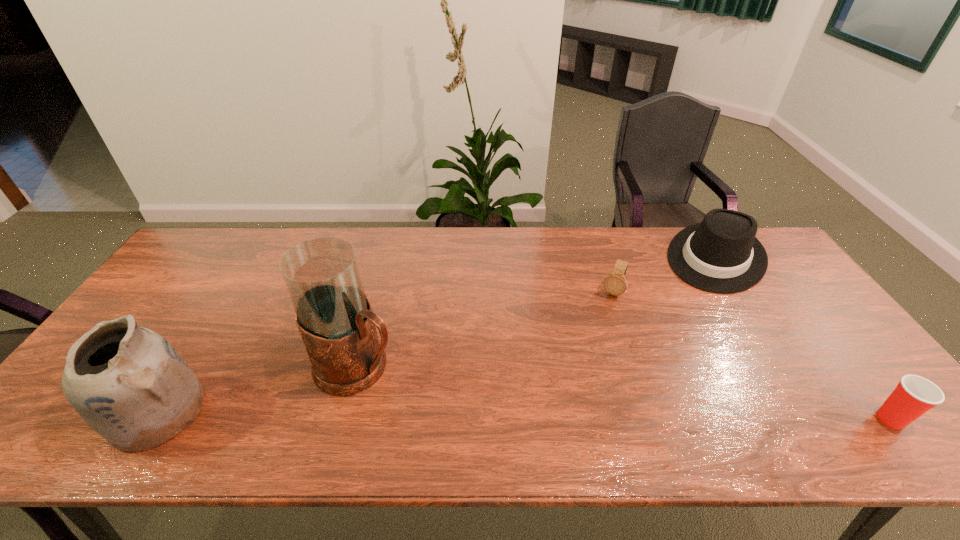
The height and width of the screenshot is (540, 960). In the image, there is a desktop. In order to click on free space at the right edge in this screenshot , I will do `click(806, 374)`.

The image size is (960, 540). I want to click on free space at the near left corner of the desktop, so click(x=70, y=412).

The height and width of the screenshot is (540, 960). In the image, there is a desktop. Identify the location of vacant space at the near right corner. (856, 409).

Locate an element on the screen. free point between the pitcher and the third object from right to left is located at coordinates tap(486, 329).

This screenshot has width=960, height=540. Find the location of `free space between the tallest object and the watch`. free space between the tallest object and the watch is located at coordinates (486, 329).

In order to click on vacant area between the fedora and the watch in this screenshot , I will do `click(664, 275)`.

The image size is (960, 540). I want to click on blank region between the watch and the tallest object, so click(x=486, y=329).

The image size is (960, 540). I want to click on free spot between the watch and the fourth object from right to left, so pyautogui.click(x=486, y=329).

I want to click on empty location between the pitcher and the fourth shortest object, so click(x=257, y=389).

Locate an element on the screen. This screenshot has width=960, height=540. vacant space that is in between the Dixie cup and the fedora is located at coordinates (804, 338).